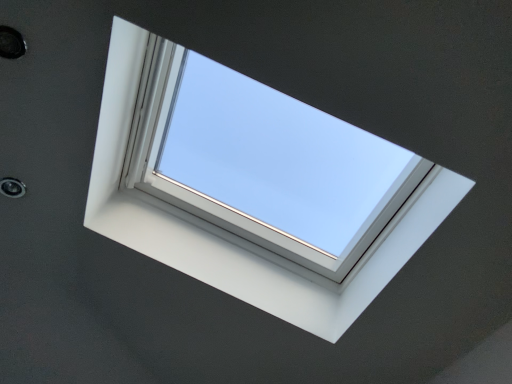
Question: Does white plastic window at center have a greater width compared to metallic circular hole at upper left, which is counted as the 2th hole, starting from the top?

Choices:
 (A) yes
 (B) no

Answer: (A)

Question: From a real-world perspective, is white plastic window at center on top of metallic circular hole at upper left, which is counted as the 2th hole, starting from the top?

Choices:
 (A) yes
 (B) no

Answer: (A)

Question: Is white plastic window at center positioned before metallic circular hole at upper left, which is the 1th hole from bottom to top?

Choices:
 (A) no
 (B) yes

Answer: (B)

Question: Considering the relative sizes of white plastic window at center and metallic circular hole at upper left, positioned as the 1th hole in left-to-right order, in the image provided, is white plastic window at center taller than metallic circular hole at upper left, positioned as the 1th hole in left-to-right order,?

Choices:
 (A) no
 (B) yes

Answer: (B)

Question: Is white plastic window at center at the right side of metallic circular hole at upper left, which is the 1th hole from bottom to top?

Choices:
 (A) yes
 (B) no

Answer: (A)

Question: Is metallic circular hole at upper left, acting as the second hole starting from the bottom, situated inside metallic circular hole at upper left, positioned as the 1th hole in left-to-right order, or outside?

Choices:
 (A) outside
 (B) inside

Answer: (A)

Question: Relative to metallic circular hole at upper left, placed as the first hole when sorted from back to front, is metallic circular hole at upper left, which is the first hole in top-to-bottom order, in front or behind?

Choices:
 (A) front
 (B) behind

Answer: (A)

Question: From a real-world perspective, is metallic circular hole at upper left, acting as the second hole starting from the bottom, above or below metallic circular hole at upper left, which is the second hole in right-to-left order?

Choices:
 (A) above
 (B) below

Answer: (A)

Question: Considering the positions of metallic circular hole at upper left, arranged as the first hole when viewed from the front, and metallic circular hole at upper left, acting as the 2th hole starting from the front, in the image, is metallic circular hole at upper left, arranged as the first hole when viewed from the front, taller or shorter than metallic circular hole at upper left, acting as the 2th hole starting from the front,?

Choices:
 (A) tall
 (B) short

Answer: (A)

Question: Looking at their shapes, would you say metallic circular hole at upper left, which is the first hole in top-to-bottom order, is wider or thinner than white plastic window at center?

Choices:
 (A) thin
 (B) wide

Answer: (A)

Question: From a real-world perspective, is metallic circular hole at upper left, which is the first hole from right to left, above or below white plastic window at center?

Choices:
 (A) below
 (B) above

Answer: (A)

Question: From their relative heights in the image, would you say metallic circular hole at upper left, acting as the second hole starting from the bottom, is taller or shorter than white plastic window at center?

Choices:
 (A) short
 (B) tall

Answer: (A)

Question: Considering the positions of point pos(2,49) and point pos(205,254), is point pos(2,49) closer or farther from the camera than point pos(205,254)?

Choices:
 (A) farther
 (B) closer

Answer: (B)

Question: Visually, is white plastic window at center positioned to the left or to the right of metallic circular hole at upper left, acting as the second hole starting from the bottom?

Choices:
 (A) left
 (B) right

Answer: (B)

Question: From a real-world perspective, is white plastic window at center positioned above or below metallic circular hole at upper left, acting as the second hole starting from the bottom?

Choices:
 (A) above
 (B) below

Answer: (A)